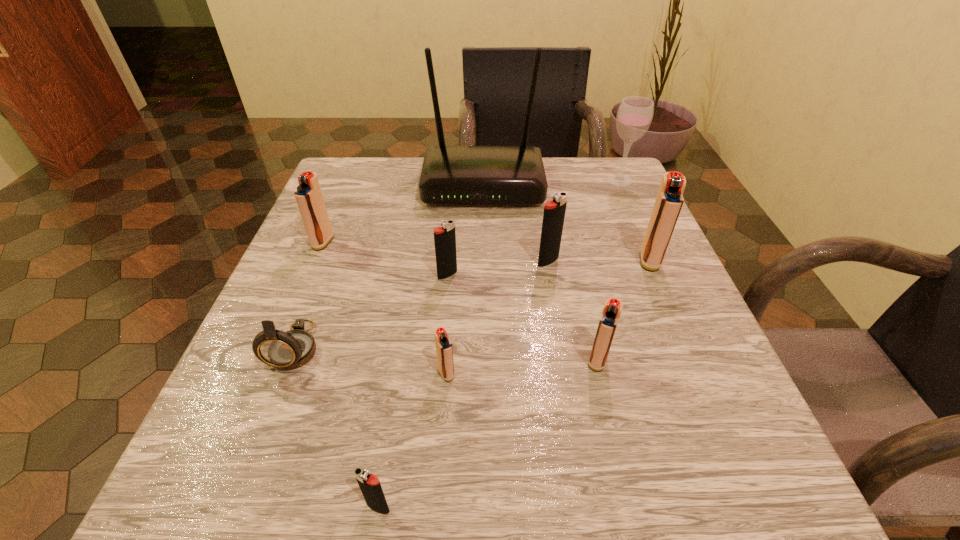
Locate an element on the screen. Image resolution: width=960 pixels, height=540 pixels. compass positioned at the left edge is located at coordinates (288, 350).

Locate an element on the screen. The width and height of the screenshot is (960, 540). wineglass that is at the right edge is located at coordinates (634, 116).

The height and width of the screenshot is (540, 960). I want to click on igniter that is positioned at the right edge, so click(669, 200).

The width and height of the screenshot is (960, 540). In order to click on object that is at the far right corner in this screenshot , I will do `click(634, 116)`.

Identify the location of vacant area at the far edge. (560, 179).

You are a GUI agent. You are given a task and a screenshot of the screen. Output one action in this format:
    pyautogui.click(x=<x>, y=<y>)
    Task: Click on the vacant space at the near edge of the desktop
    Image resolution: width=960 pixels, height=540 pixels.
    Given the screenshot: What is the action you would take?
    pyautogui.click(x=386, y=454)

In the image, there is a desktop. At what (x,y) coordinates should I click in order to perform the action: click on free space at the left edge. Please return your answer as a coordinate pair (x, y). This screenshot has width=960, height=540. Looking at the image, I should click on (252, 340).

Find the location of `vacant region at the right edge of the desktop`. vacant region at the right edge of the desktop is located at coordinates click(621, 214).

In the image, there is a desktop. Identify the location of vacant space at the far left corner. (329, 197).

Identify the location of vacant area at the far right corner of the desktop. The height and width of the screenshot is (540, 960). (595, 200).